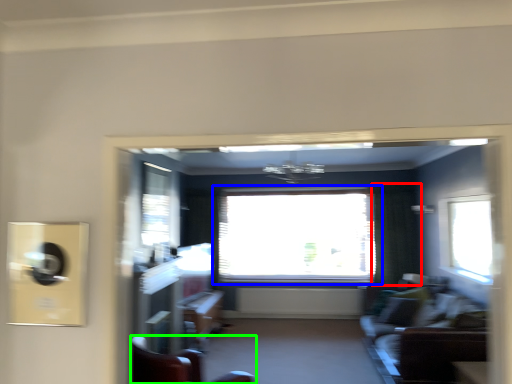
Question: Based on their relative distances, which object is nearer to curtain (highlighted by a red box)? Choose from window (highlighted by a blue box) and furniture (highlighted by a green box).

Choices:
 (A) window
 (B) furniture

Answer: (A)